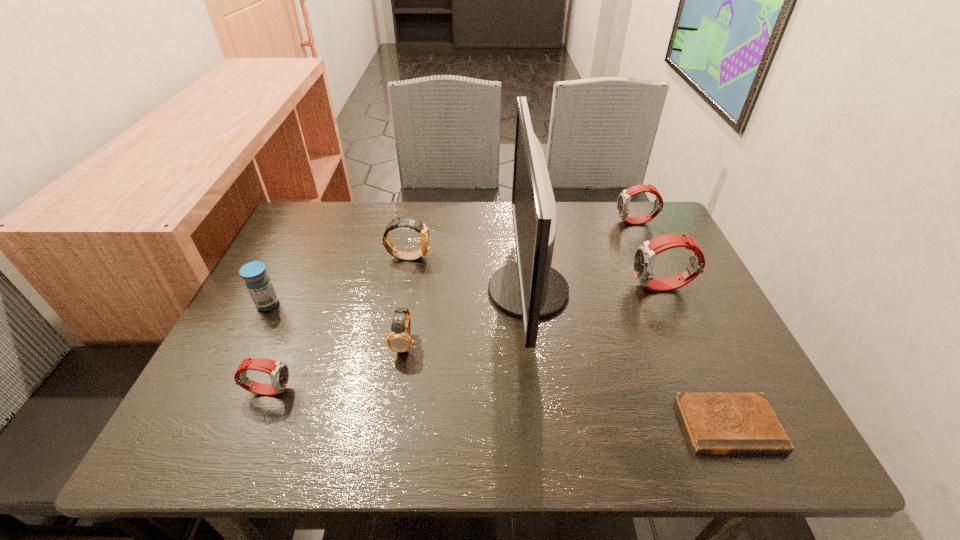
The width and height of the screenshot is (960, 540). In order to click on monitor in this screenshot , I will do `click(530, 288)`.

In order to click on the tallest object in this screenshot , I will do `click(530, 288)`.

Find the location of a particular element. The image size is (960, 540). the biggest red watch is located at coordinates (644, 259).

Find the location of a particular element. the second farthest red watch is located at coordinates (644, 259).

The height and width of the screenshot is (540, 960). Find the location of `the second farthest watch`. the second farthest watch is located at coordinates (422, 229).

This screenshot has height=540, width=960. I want to click on the farther gold watch, so click(422, 229).

This screenshot has height=540, width=960. I want to click on the farthest watch, so click(623, 203).

Locate an element on the screen. the farthest object is located at coordinates (623, 203).

The image size is (960, 540). What are the coordinates of `the leftmost object` in the screenshot? It's located at (257, 281).

The height and width of the screenshot is (540, 960). I want to click on medicine, so click(x=257, y=281).